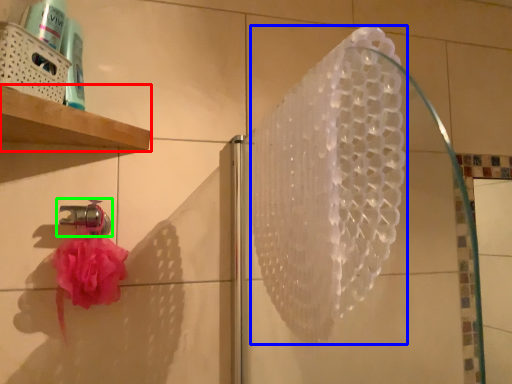
Question: Which object is the farthest from shelf (highlighted by a red box)? Choose among these: shower (highlighted by a blue box) or tap (highlighted by a green box).

Choices:
 (A) shower
 (B) tap

Answer: (A)